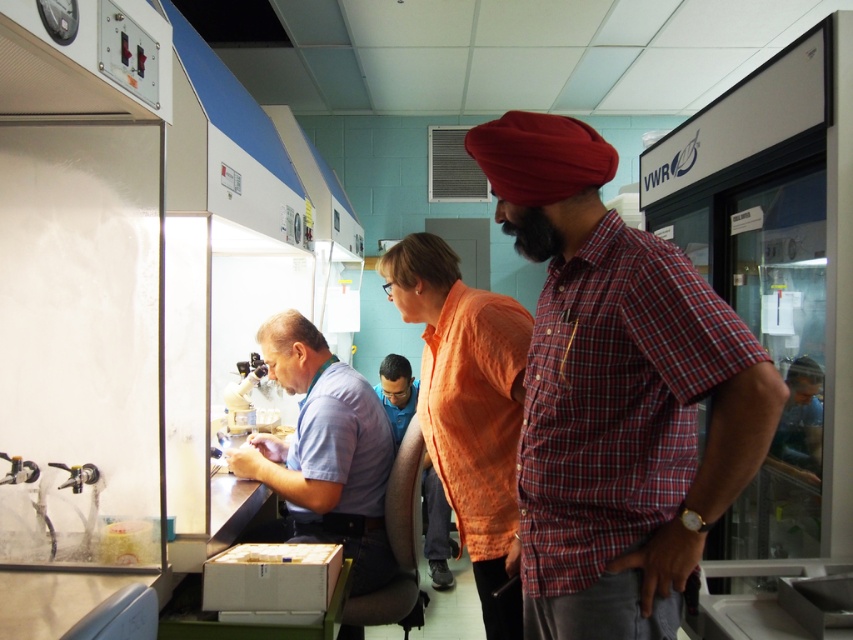
You are a researcher in the lab and need to determine which shirt takes up more space. Which of the two shirts, the orange fabric shirt at center or the blue fabric shirt at center, has a larger size?

The orange fabric shirt at center is larger in size than the blue fabric shirt at center, so it takes up more space.

You are a researcher in the lab and need to pass through the narrow corridor between the red plaid shirt at center and the orange fabric shirt at center. The corridor is 1.2 meters wide. Can you fit through if you keep to one side?

The red plaid shirt at center is wider than the orange fabric shirt at center. Since the corridor is 1.2 meters wide, and the red plaid shirt at center is wider, the total width occupied by both might exceed the corridor width. It is safer to check the exact widths before attempting to pass through.

You are standing in the laboratory and need to locate the red plaid shirt at center. Based on the coordinate system where the bottom left corner is the origin, can you determine its location?

The red plaid shirt at center is located at coordinates point (616,394).